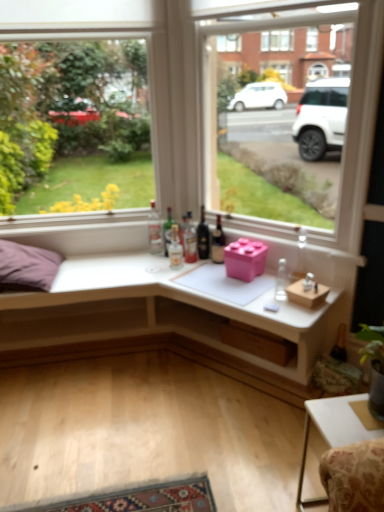
Question: Is dark glass bottle at center, which is the 5th bottle in left-to-right order, touching clear glass bottle at center, which appears as the first bottle when viewed from the left?

Choices:
 (A) yes
 (B) no

Answer: (B)

Question: From a real-world perspective, does dark glass bottle at center, positioned as the 3th bottle in right-to-left order, sit lower than clear glass bottle at center, which appears as the first bottle when viewed from the left?

Choices:
 (A) no
 (B) yes

Answer: (B)

Question: Would you consider dark glass bottle at center, positioned as the 3th bottle in right-to-left order, to be distant from clear glass bottle at center, which appears as the first bottle when viewed from the left?

Choices:
 (A) no
 (B) yes

Answer: (A)

Question: Is dark glass bottle at center, which is the 5th bottle in left-to-right order, wider than clear glass bottle at center, which appears as the first bottle when viewed from the left?

Choices:
 (A) yes
 (B) no

Answer: (B)

Question: From the image's perspective, is dark glass bottle at center, which is the 5th bottle in left-to-right order, located beneath clear glass bottle at center, which appears as the first bottle when viewed from the left?

Choices:
 (A) no
 (B) yes

Answer: (B)

Question: Considering the relative positions of dark glass bottle at center, positioned as the 3th bottle in right-to-left order, and clear glass bottle at center, the 7th bottle positioned from the right, in the image provided, is dark glass bottle at center, positioned as the 3th bottle in right-to-left order, to the right of clear glass bottle at center, the 7th bottle positioned from the right, from the viewer's perspective?

Choices:
 (A) yes
 (B) no

Answer: (A)

Question: Can you confirm if transparent glass window at upper center, which appears as the first window when viewed from the left, is taller than dark glass bottle at center, the 2th bottle positioned from the right?

Choices:
 (A) no
 (B) yes

Answer: (B)

Question: Considering the relative sizes of transparent glass window at upper center, which appears as the first window when viewed from the left, and dark glass bottle at center, the 2th bottle positioned from the right, in the image provided, is transparent glass window at upper center, which appears as the first window when viewed from the left, bigger than dark glass bottle at center, the 2th bottle positioned from the right,?

Choices:
 (A) yes
 (B) no

Answer: (A)

Question: From a real-world perspective, is transparent glass window at upper center, which appears as the first window when viewed from the left, over dark glass bottle at center, the 6th bottle viewed from the left?

Choices:
 (A) no
 (B) yes

Answer: (B)

Question: Is transparent glass window at upper center, which appears as the first window when viewed from the left, positioned beyond the bounds of dark glass bottle at center, the 6th bottle viewed from the left?

Choices:
 (A) no
 (B) yes

Answer: (B)

Question: Considering the relative positions of transparent glass window at upper center, which is counted as the second window, starting from the right, and dark glass bottle at center, the 2th bottle positioned from the right, in the image provided, is transparent glass window at upper center, which is counted as the second window, starting from the right, to the left of dark glass bottle at center, the 2th bottle positioned from the right, from the viewer's perspective?

Choices:
 (A) yes
 (B) no

Answer: (A)

Question: Can you confirm if transparent glass window at upper center, which appears as the first window when viewed from the left, is thinner than dark glass bottle at center, the 2th bottle positioned from the right?

Choices:
 (A) no
 (B) yes

Answer: (A)

Question: From the image's perspective, is wooden at lower center, the first window box positioned from the bottom, below translucent glass bottle at center, the 5th bottle when ordered from right to left?

Choices:
 (A) no
 (B) yes

Answer: (B)